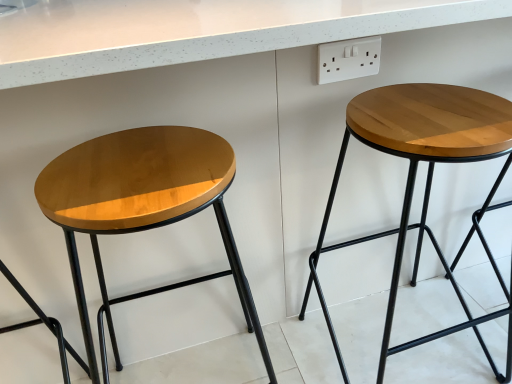
Question: From a real-world perspective, is white plastic socket at upper right located higher than wooden stool at right, which appears as the second stool when viewed from the left?

Choices:
 (A) no
 (B) yes

Answer: (B)

Question: Is white plastic socket at upper right placed right next to wooden stool at right, which appears as the second stool when viewed from the left?

Choices:
 (A) yes
 (B) no

Answer: (B)

Question: Is the depth of white plastic socket at upper right greater than that of wooden stool at right, which is the first stool from right to left?

Choices:
 (A) no
 (B) yes

Answer: (B)

Question: Could you tell me if white plastic socket at upper right is turned towards wooden stool at right, which is the first stool from right to left?

Choices:
 (A) no
 (B) yes

Answer: (A)

Question: Considering the relative sizes of white plastic socket at upper right and wooden stool at right, which is the first stool from right to left, in the image provided, is white plastic socket at upper right taller than wooden stool at right, which is the first stool from right to left,?

Choices:
 (A) yes
 (B) no

Answer: (B)

Question: Does white plastic socket at upper right have a smaller size compared to wooden stool at right, which is the first stool from right to left?

Choices:
 (A) no
 (B) yes

Answer: (B)

Question: Can you confirm if wooden stool at right, which is the first stool from right to left, is bigger than white plastic socket at upper right?

Choices:
 (A) yes
 (B) no

Answer: (A)

Question: Can you confirm if wooden stool at right, which is the first stool from right to left, is positioned to the left of white plastic socket at upper right?

Choices:
 (A) no
 (B) yes

Answer: (A)

Question: Is wooden stool at right, which appears as the second stool when viewed from the left, in front of white plastic socket at upper right?

Choices:
 (A) yes
 (B) no

Answer: (A)

Question: Are wooden stool at right, which appears as the second stool when viewed from the left, and white plastic socket at upper right making contact?

Choices:
 (A) yes
 (B) no

Answer: (B)

Question: From a real-world perspective, is wooden stool at right, which appears as the second stool when viewed from the left, physically above white plastic socket at upper right?

Choices:
 (A) no
 (B) yes

Answer: (A)

Question: From a real-world perspective, is wooden stool at right, which appears as the second stool when viewed from the left, under white plastic socket at upper right?

Choices:
 (A) no
 (B) yes

Answer: (B)

Question: From a real-world perspective, does white plastic socket at upper right sit lower than glossy wood stool at left, positioned as the second stool in right-to-left order?

Choices:
 (A) yes
 (B) no

Answer: (B)